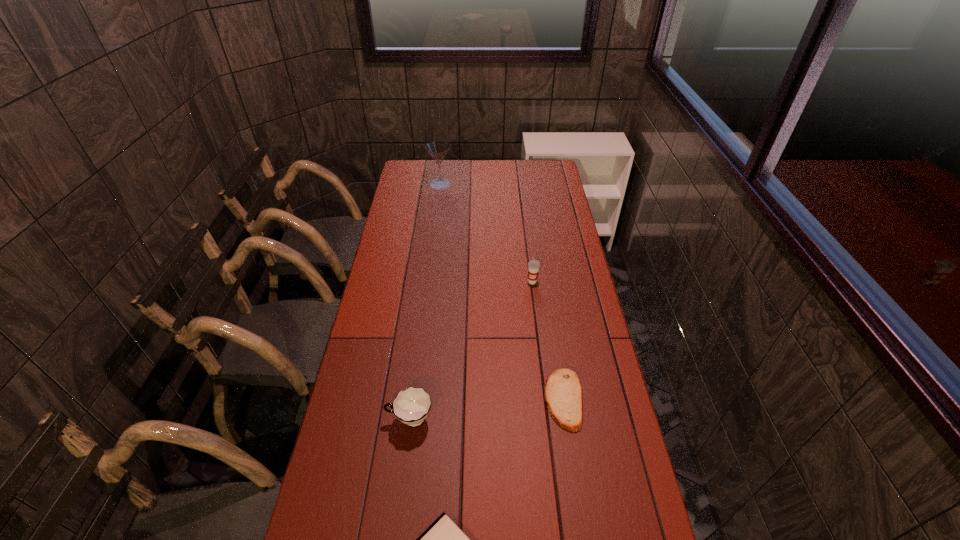
Where is `free space located 0.090m on the side of the nearer cup with the handle`? The width and height of the screenshot is (960, 540). free space located 0.090m on the side of the nearer cup with the handle is located at coordinates (355, 420).

Locate an element on the screen. vacant point located on the side of the nearer cup with the handle is located at coordinates (359, 420).

Identify the location of free spot located on the left of the second shortest object. This screenshot has height=540, width=960. (417, 399).

Locate an element on the screen. Image resolution: width=960 pixels, height=540 pixels. object that is at the far edge is located at coordinates (437, 149).

Locate an element on the screen. This screenshot has width=960, height=540. flute glass located at the left edge is located at coordinates (437, 149).

The height and width of the screenshot is (540, 960). In order to click on cup at the left edge in this screenshot , I will do `click(411, 406)`.

At what (x,y) coordinates should I click in order to perform the action: click on object that is at the right edge. Please return your answer as a coordinate pair (x, y). Looking at the image, I should click on (563, 393).

The width and height of the screenshot is (960, 540). Identify the location of object that is at the far left corner. (437, 149).

The image size is (960, 540). What are the coordinates of `vacant area at the far edge of the desktop` in the screenshot? It's located at (499, 168).

In the image, there is a desktop. In order to click on vacant space at the left edge in this screenshot , I will do `click(406, 186)`.